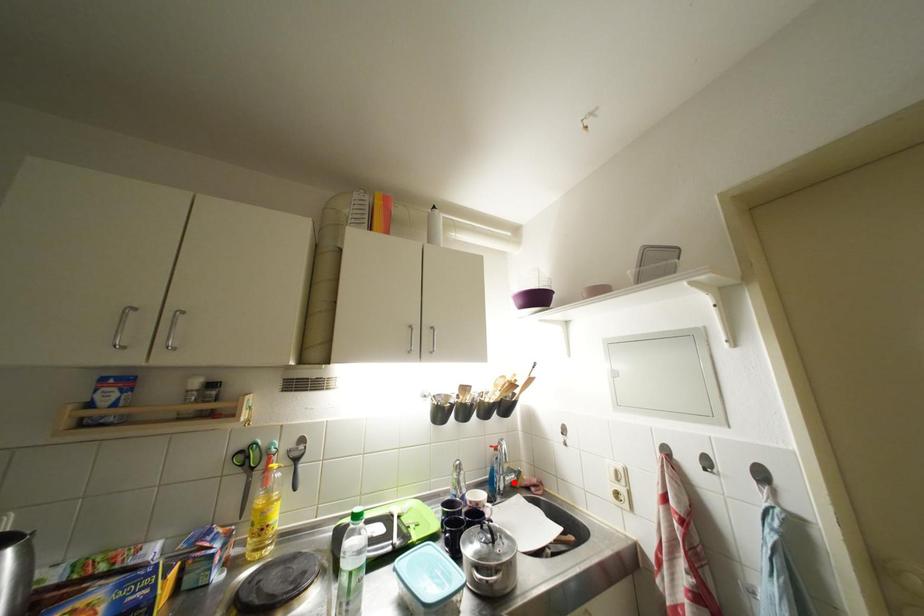
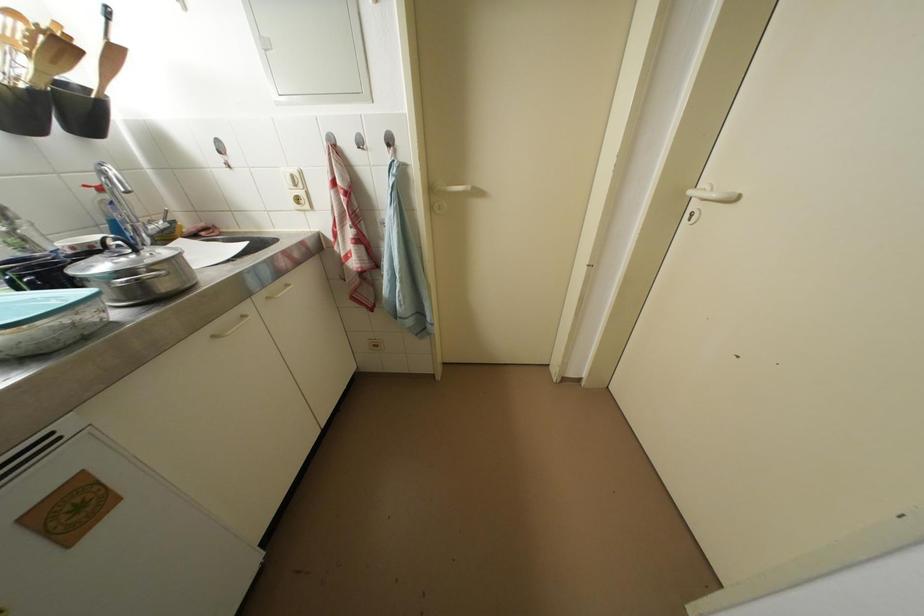
Question: A red point is marked in image1. In image2, is the corresponding 3D point closer to the camera or farther? Reply with the corresponding letter.

Choices:
 (A) The corresponding 3D point is closer.
 (B) The corresponding 3D point is farther.

Answer: (A)